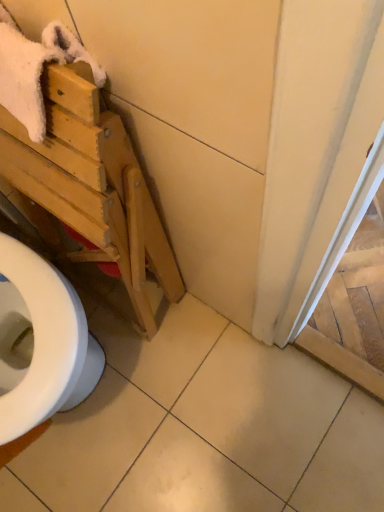
Question: From a real-world perspective, relative to white tile at center, is white fluffy bath towel at upper left vertically above or below?

Choices:
 (A) below
 (B) above

Answer: (B)

Question: Is white fluffy bath towel at upper left bigger or smaller than white tile at center?

Choices:
 (A) big
 (B) small

Answer: (B)

Question: Which object is the closest to the white fluffy bath towel at upper left?

Choices:
 (A) white tile at center
 (B) light wood folding chair at left

Answer: (B)

Question: Estimate the real-world distances between objects in this image. Which object is closer to the light wood folding chair at left?

Choices:
 (A) white fluffy bath towel at upper left
 (B) white tile at center

Answer: (A)